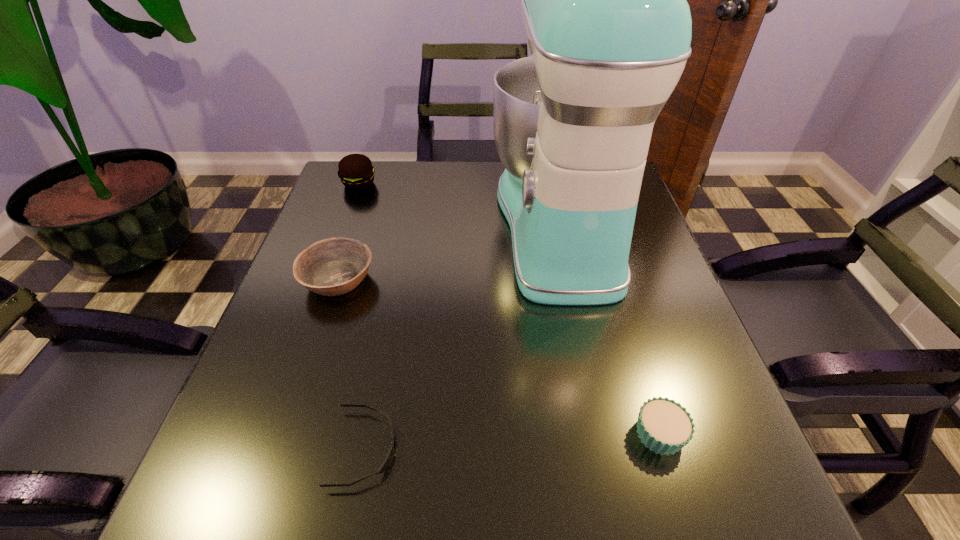
This screenshot has height=540, width=960. Find the location of `vacant area that lies between the patty and the sunglasses`. vacant area that lies between the patty and the sunglasses is located at coordinates (362, 316).

Where is `free area in between the tallest object and the sunglasses`? The width and height of the screenshot is (960, 540). free area in between the tallest object and the sunglasses is located at coordinates (462, 336).

What are the coordinates of `free space between the third shortest object and the second tallest object` in the screenshot? It's located at (348, 232).

Where is `free space that is in between the cupcake and the shortest object`? The width and height of the screenshot is (960, 540). free space that is in between the cupcake and the shortest object is located at coordinates (512, 441).

At what (x,y) coordinates should I click in order to perform the action: click on empty space that is in between the fourth shortest object and the mixer. Please return your answer as a coordinate pair (x, y). The height and width of the screenshot is (540, 960). Looking at the image, I should click on (459, 204).

Where is `unoccupied area between the shortest object and the mixer`? The width and height of the screenshot is (960, 540). unoccupied area between the shortest object and the mixer is located at coordinates coord(462,336).

Image resolution: width=960 pixels, height=540 pixels. I want to click on object that ranks as the third closest to the third tallest object, so click(x=604, y=4).

Find the location of a particular element. The image size is (960, 540). the fourth closest object to the cupcake is located at coordinates (356, 172).

You are a GUI agent. You are given a task and a screenshot of the screen. Output one action in this format:
    pyautogui.click(x=<x>, y=<y>)
    Task: Click on the blank space that satisfies the following two spatial constraints: 1. on the front side of the fourth tallest object; 2. on the front-facing side of the sunglasses
    
    Given the screenshot: What is the action you would take?
    point(664,448)

The width and height of the screenshot is (960, 540). What are the coordinates of `free spot that satisfies the following two spatial constraints: 1. at the base of the mixer; 2. on the right side of the cupcake` in the screenshot? It's located at (603, 434).